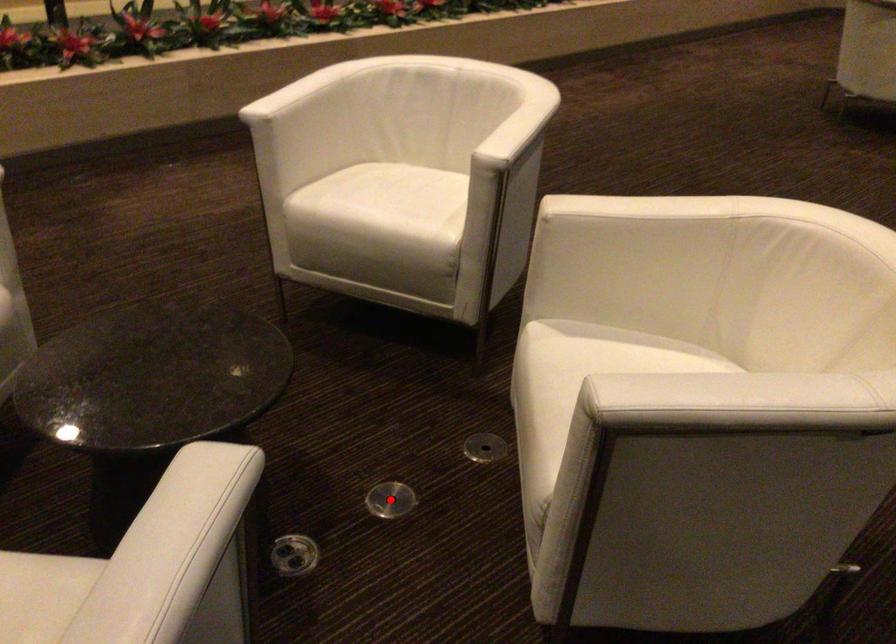
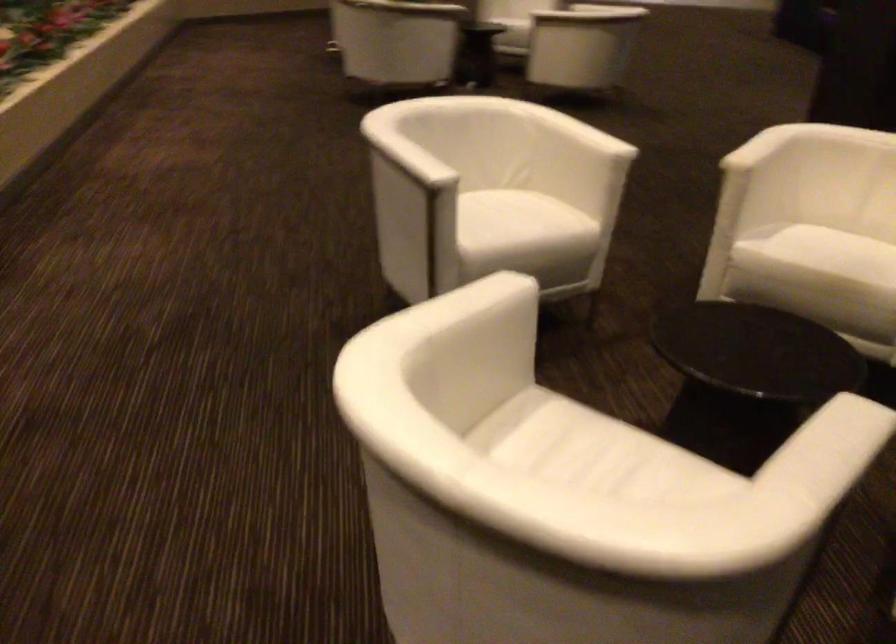
Question: I am providing you with two images of the same scene from different viewpoints. A red point is marked on the first image. At the location where the point appears in image 1, is it still visible in image 2?

Choices:
 (A) Yes
 (B) No

Answer: (B)